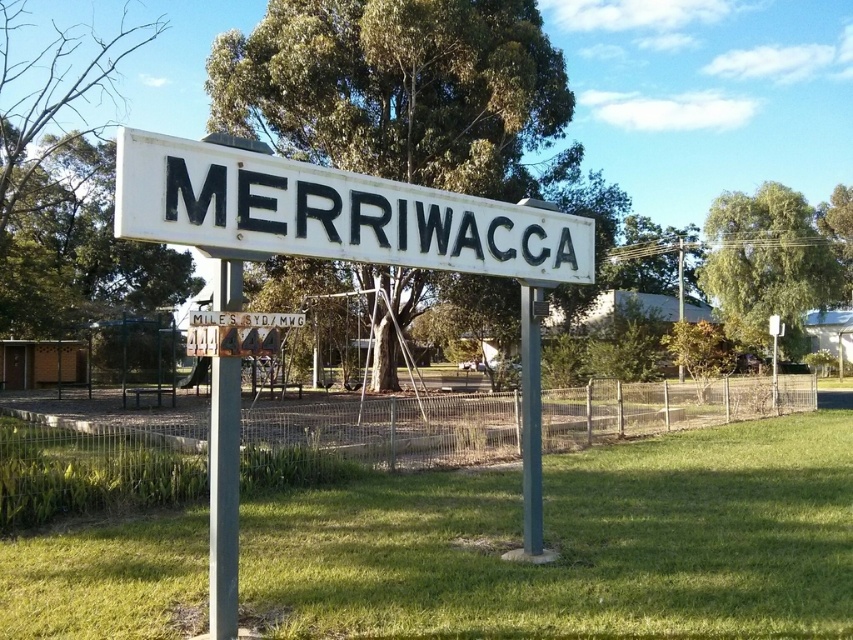
From the picture: You are standing at the edge of the park and see the green grass at center and the white matte sign at center. Which object is located to the right of the other?

The green grass at center is positioned on the right side of white matte sign at center.

You are a visitor trying to read the white matte sign at center and the green painted metal pole at center. Which object is smaller in size?

The white matte sign at center is smaller than the green painted metal pole at center.